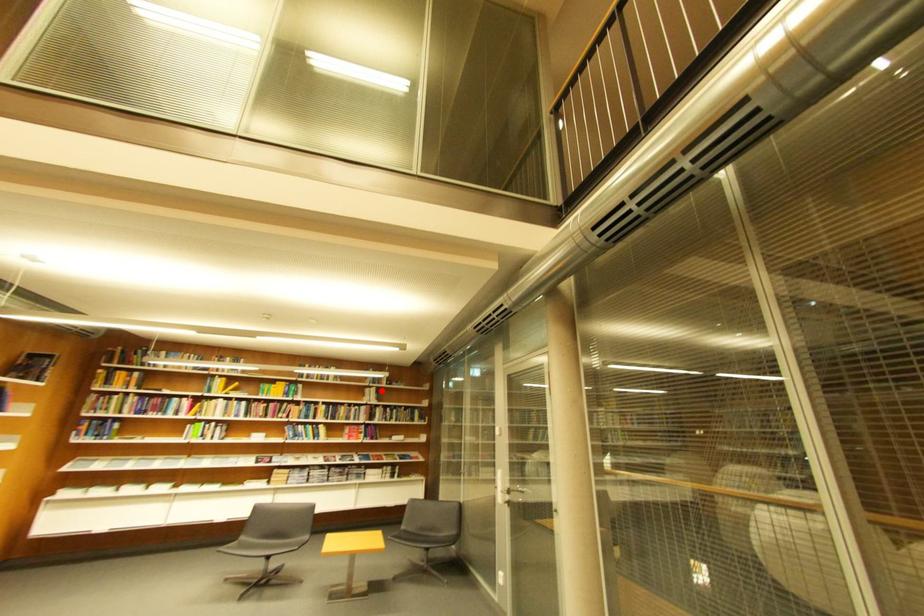
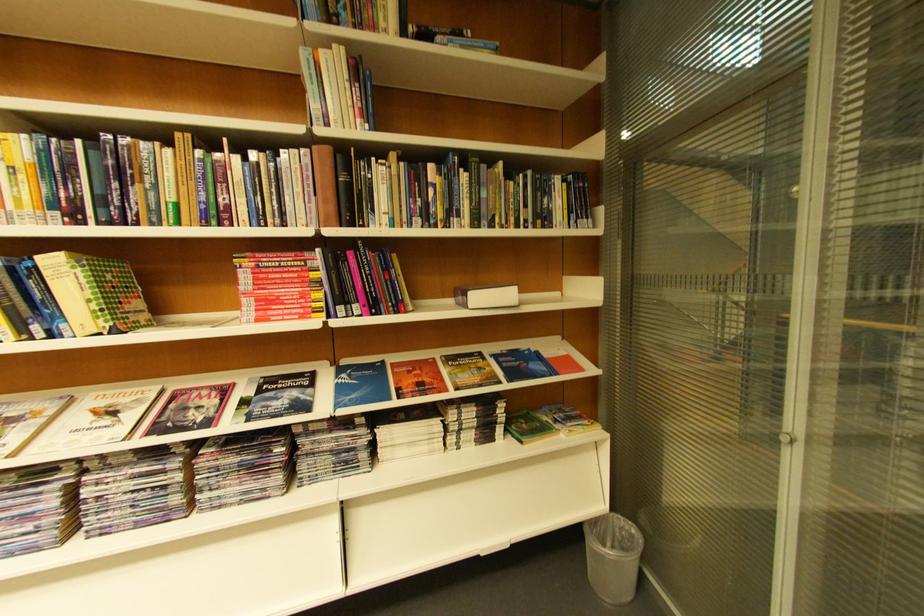
Where in the second image is the point corresponding to the highlighted location from the first image?

(332, 55)